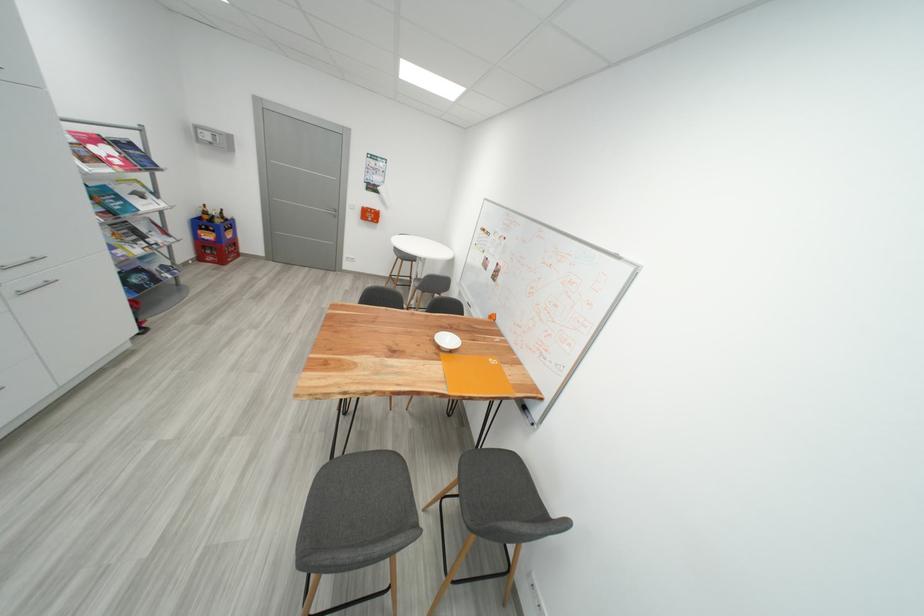
The location [103,150] corresponds to which object?

It corresponds to the red magazine in the image.